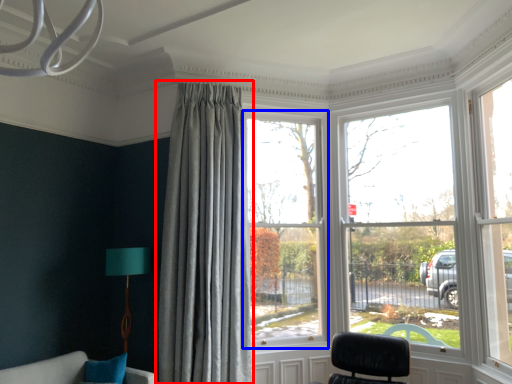
Question: Which object is closer to the camera taking this photo, curtain (highlighted by a red box) or window (highlighted by a blue box)?

Choices:
 (A) curtain
 (B) window

Answer: (A)